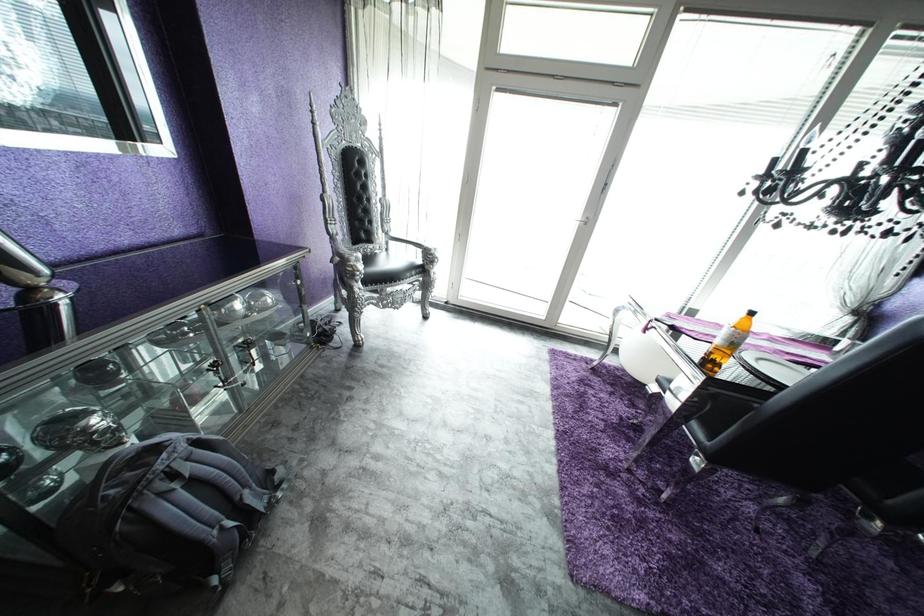
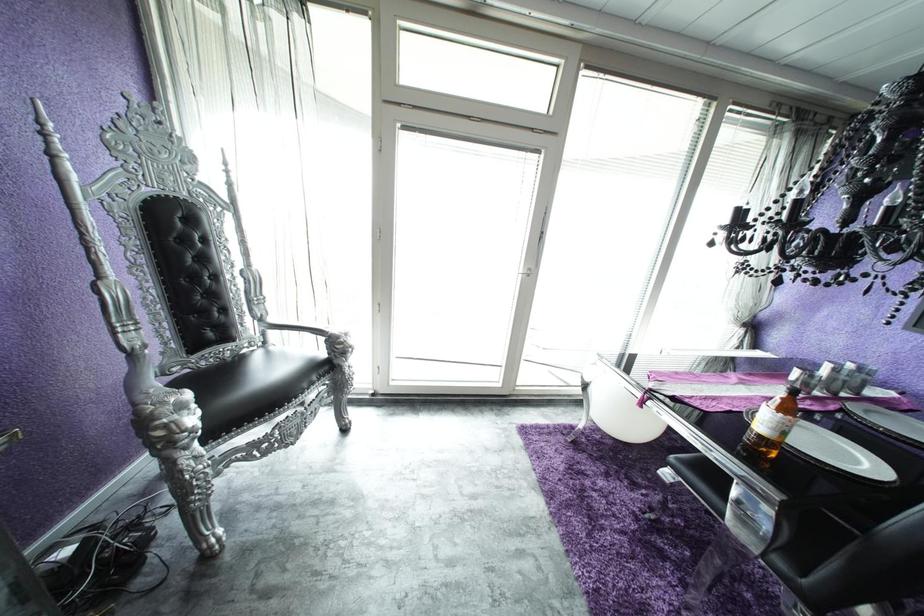
Question: Which direction would the cameraman need to move to produce the second image? Reply with the corresponding letter.

Choices:
 (A) Left
 (B) Right
 (C) Forward
 (D) Backward

Answer: (C)